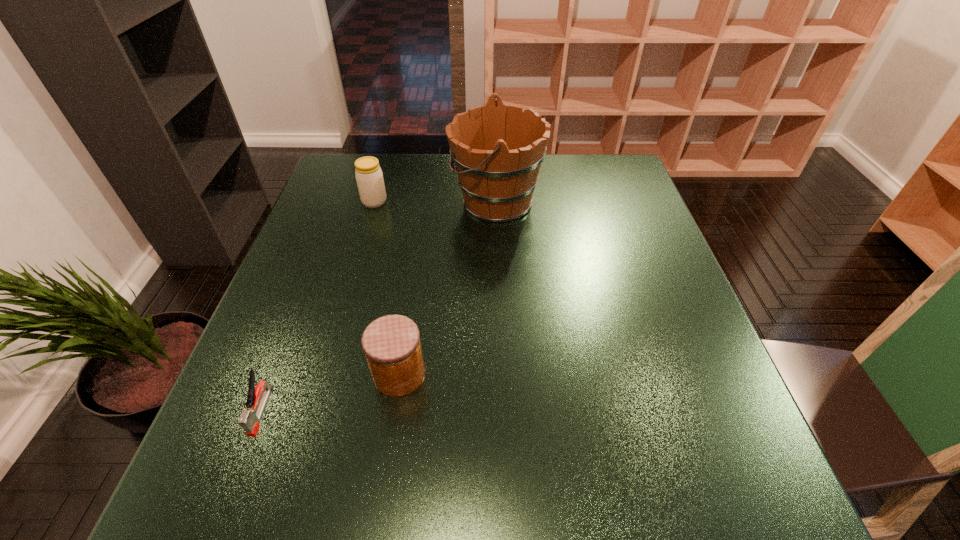
Locate an element on the screen. Image resolution: width=960 pixels, height=540 pixels. vacant space located with the handle on the tallest object is located at coordinates (365, 201).

Identify the location of free region located 0.070m on the front of the farther jar. (368, 225).

Find the location of `vacant space located 0.200m on the front of the third object from left to right`. vacant space located 0.200m on the front of the third object from left to right is located at coordinates (377, 516).

In order to click on free space located 0.050m on the handle side of the leftmost object in this screenshot , I will do `click(241, 466)`.

This screenshot has width=960, height=540. Find the location of `wine bucket at the far edge`. wine bucket at the far edge is located at coordinates (497, 150).

Locate an element on the screen. The height and width of the screenshot is (540, 960). jar located at the far edge is located at coordinates (369, 177).

Find the location of a particular element. This screenshot has width=960, height=540. jar at the left edge is located at coordinates coord(369,177).

I want to click on stapler that is positioned at the left edge, so click(250, 418).

I want to click on object located in the far left corner section of the desktop, so click(369, 177).

Image resolution: width=960 pixels, height=540 pixels. What are the coordinates of `free spot at the far edge of the desktop` in the screenshot? It's located at (414, 173).